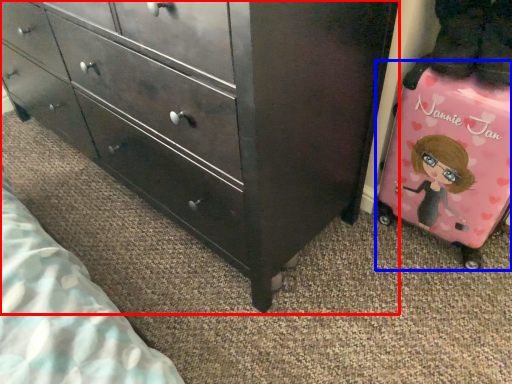
Question: Which of the following is the closest to the observer, chest of drawers (highlighted by a red box) or luggage (highlighted by a blue box)?

Choices:
 (A) chest of drawers
 (B) luggage

Answer: (A)